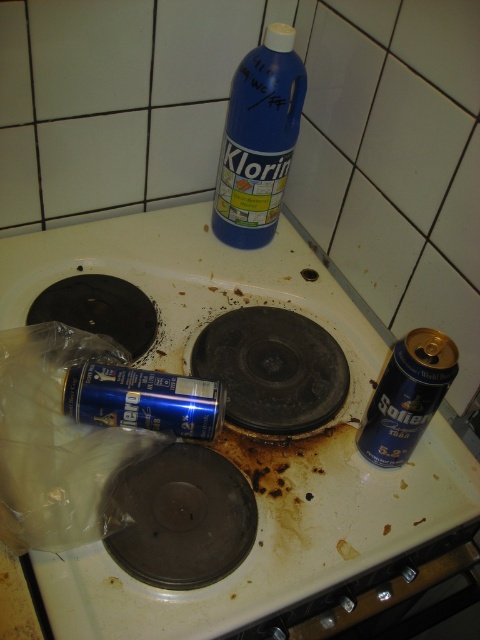
Question: Can you confirm if blue metallic can at center is positioned to the right of blue plastic bottle at upper center?

Choices:
 (A) yes
 (B) no

Answer: (B)

Question: Which point is closer to the camera?

Choices:
 (A) blue plastic bottle at upper center
 (B) blue metallic can at center

Answer: (B)

Question: Is blue metallic can at center in front of blue plastic bottle at upper center?

Choices:
 (A) yes
 (B) no

Answer: (A)

Question: Observing the image, what is the correct spatial positioning of blue metallic can at center in reference to blue plastic bottle at upper center?

Choices:
 (A) left
 (B) right

Answer: (A)

Question: Which of the following is the farthest from the observer?

Choices:
 (A) (334, 436)
 (B) (257, 172)

Answer: (B)